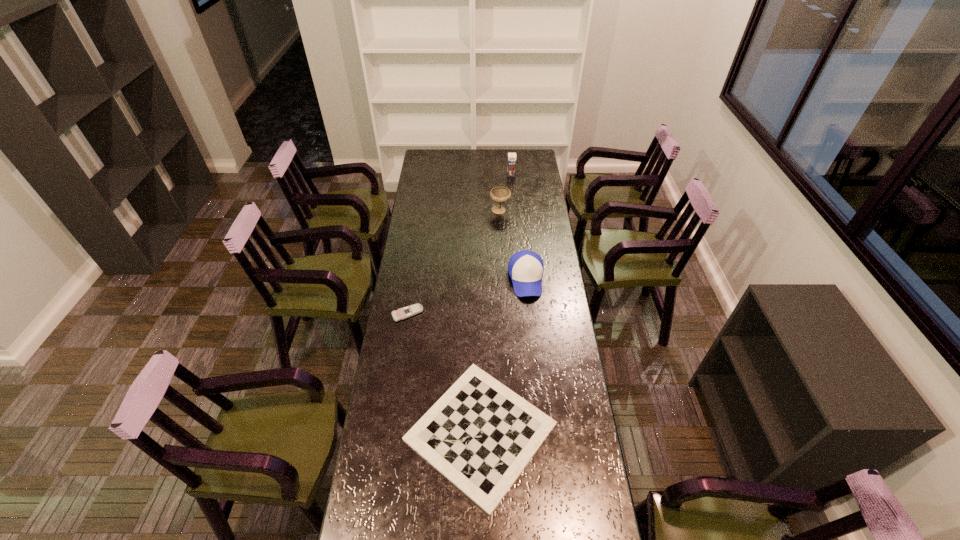
Identify which object is the third nearest to the third nearest object. Please provide its 2D coordinates. Your answer should be formatted as a tuple, i.e. [(x, y)], where the tuple contains the x and y coordinates of a point satisfying the conditions above.

[(403, 313)]

This screenshot has height=540, width=960. I want to click on vacant space that satisfies the following two spatial constraints: 1. on the back side of the second farthest object; 2. on the left side of the remote control, so click(x=422, y=211).

Where is `free location that satisfies the following two spatial constraints: 1. on the back side of the fourth nearest object; 2. on the left side of the fourth farthest object`? The image size is (960, 540). free location that satisfies the following two spatial constraints: 1. on the back side of the fourth nearest object; 2. on the left side of the fourth farthest object is located at coordinates (422, 211).

The height and width of the screenshot is (540, 960). I want to click on vacant space that satisfies the following two spatial constraints: 1. on the back side of the chalice; 2. on the left side of the checkerboard, so click(x=480, y=211).